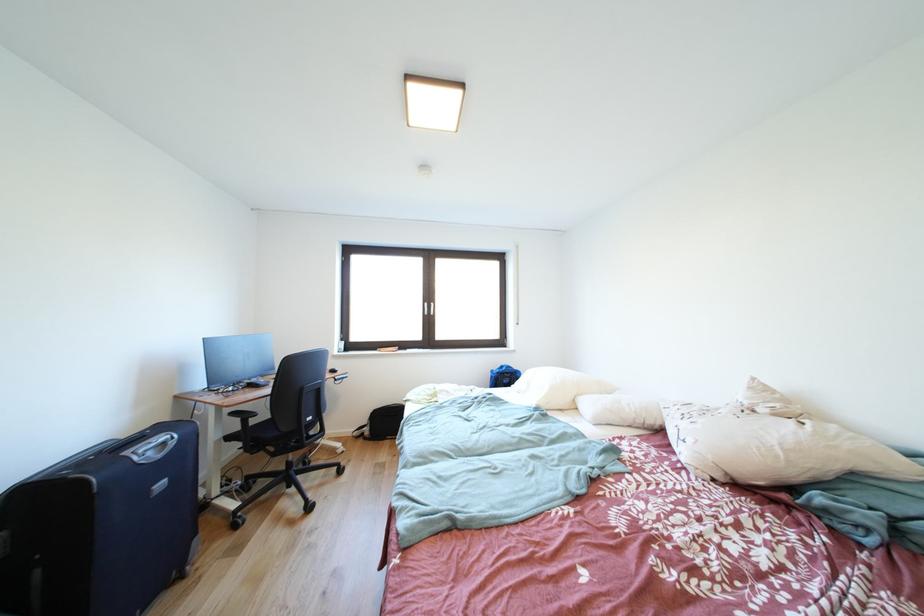
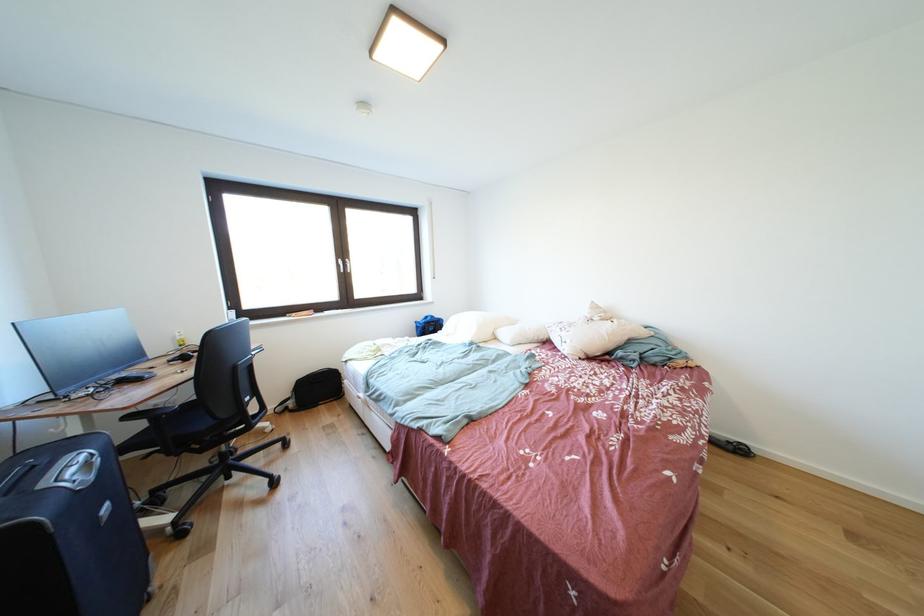
Locate, in the second image, the point that corresponds to point 693,428 in the first image.

(572, 338)